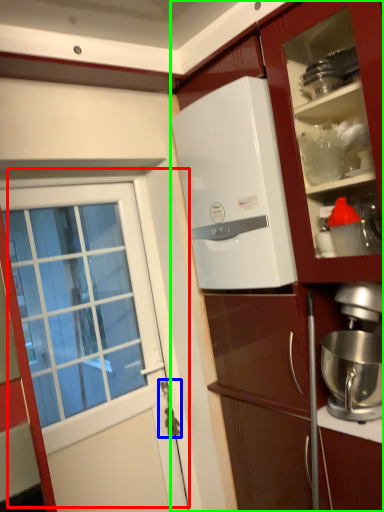
Question: Which is farther away from door (highlighted by a red box)? door handle (highlighted by a blue box) or cabinetry (highlighted by a green box)?

Choices:
 (A) door handle
 (B) cabinetry

Answer: (B)